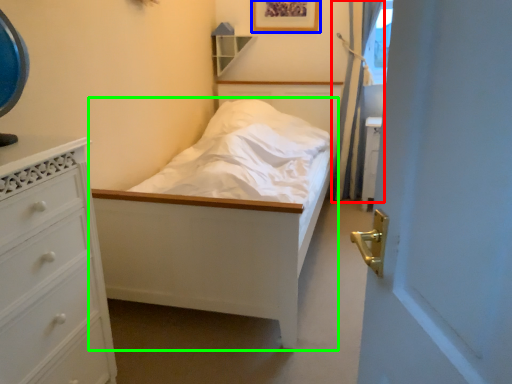
Question: Estimate the real-world distances between objects in this image. Which object is farther from curtain (highlighted by a red box), picture frame (highlighted by a blue box) or bed (highlighted by a green box)?

Choices:
 (A) picture frame
 (B) bed

Answer: (B)